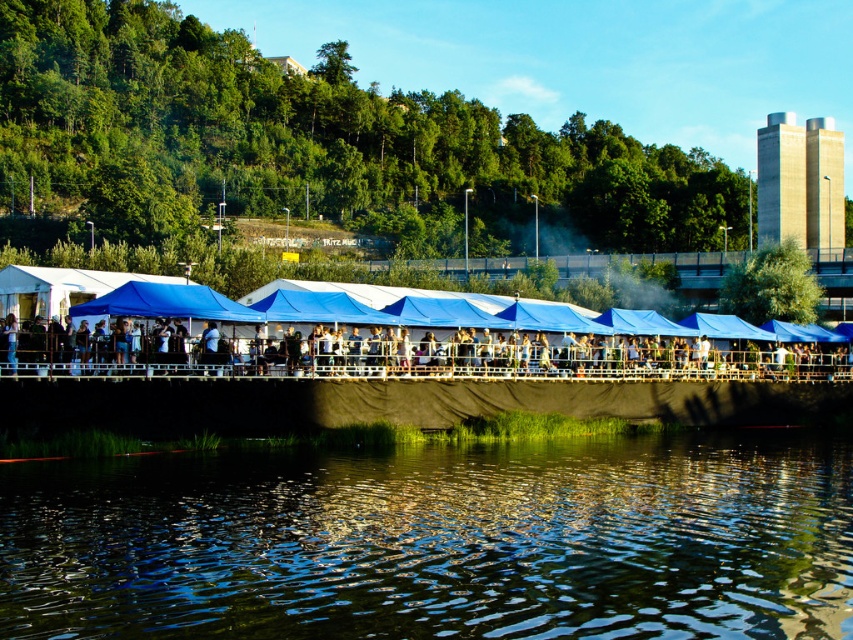
Question: Considering the relative positions of green reflective water at lower center and blue fabric canopy at center in the image provided, where is green reflective water at lower center located with respect to blue fabric canopy at center?

Choices:
 (A) above
 (B) below

Answer: (B)

Question: Observing the image, what is the correct spatial positioning of green reflective water at lower center in reference to blue fabric canopy at center?

Choices:
 (A) left
 (B) right

Answer: (B)

Question: Which of the following is the farthest from the observer?

Choices:
 (A) (190, 284)
 (B) (792, 531)

Answer: (A)

Question: Is green reflective water at lower center bigger than white fabric tent at center?

Choices:
 (A) no
 (B) yes

Answer: (A)

Question: Which is nearer to the green reflective water at lower center?

Choices:
 (A) white fabric tent at center
 (B) blue fabric canopy at center

Answer: (A)

Question: Which point appears farthest from the camera in this image?

Choices:
 (A) (734, 630)
 (B) (349, 362)
 (C) (164, 285)

Answer: (B)